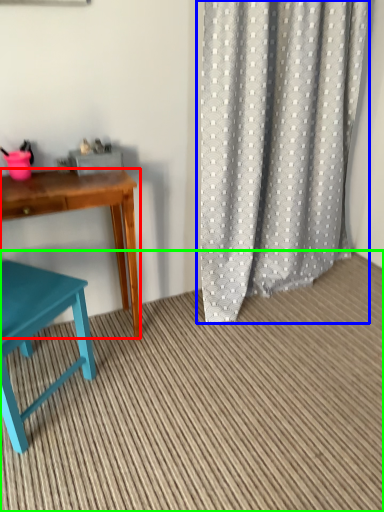
Question: Which object is positioned farthest from desk (highlighted by a red box)? Select from curtain (highlighted by a blue box) and plain (highlighted by a green box).

Choices:
 (A) curtain
 (B) plain

Answer: (A)